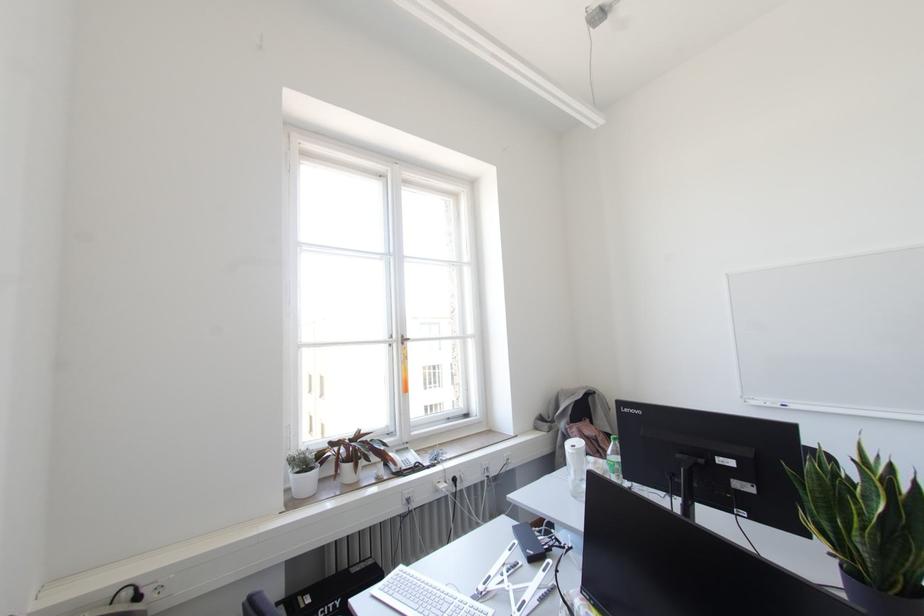
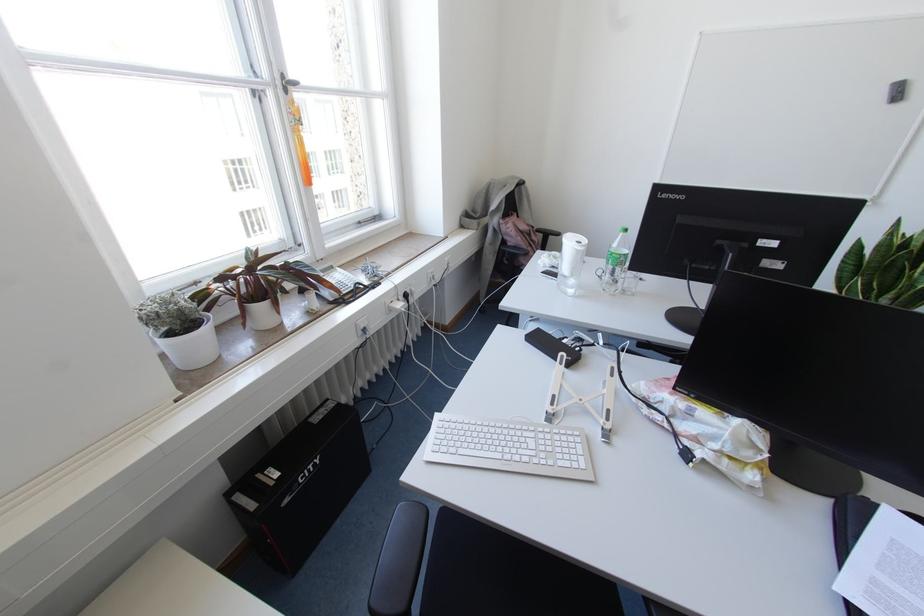
Find the pixel in the second image that matches [410,450] in the first image.

(336, 268)